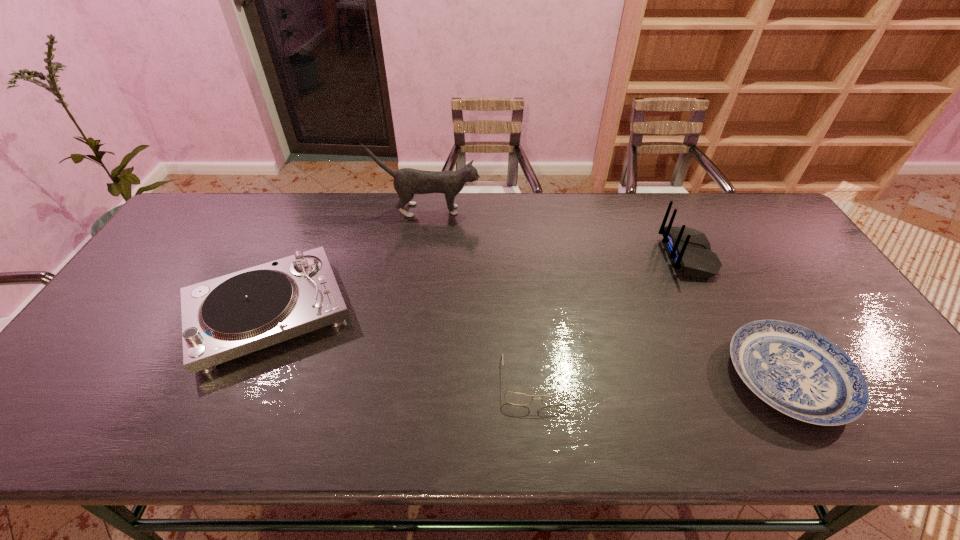
Find the location of `free location located 0.370m on the right of the record player`. free location located 0.370m on the right of the record player is located at coordinates pos(492,313).

Where is `free spot located on the back of the plate`? The width and height of the screenshot is (960, 540). free spot located on the back of the plate is located at coordinates (724, 264).

Find the location of a particular element. This screenshot has height=540, width=960. cat situated at the far edge is located at coordinates (407, 181).

The height and width of the screenshot is (540, 960). In order to click on router located at the far edge in this screenshot , I will do `click(689, 249)`.

I want to click on object at the near edge, so click(797, 371).

Locate an element on the screen. This screenshot has width=960, height=540. object present at the right edge is located at coordinates (797, 371).

The height and width of the screenshot is (540, 960). I want to click on object situated at the near right corner, so click(x=797, y=371).

This screenshot has height=540, width=960. Identify the location of free space at the far edge of the desktop. (682, 197).

Locate an element on the screen. The width and height of the screenshot is (960, 540). free location at the left edge is located at coordinates (200, 266).

You are a GUI agent. You are given a task and a screenshot of the screen. Output one action in this format:
    pyautogui.click(x=<x>, y=<y>)
    Task: Click on the vacant space at the right edge of the desktop
    
    Given the screenshot: What is the action you would take?
    pyautogui.click(x=876, y=372)